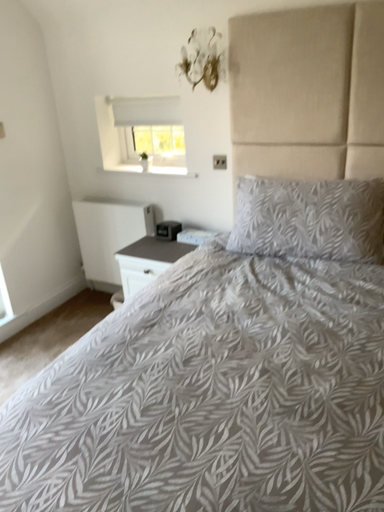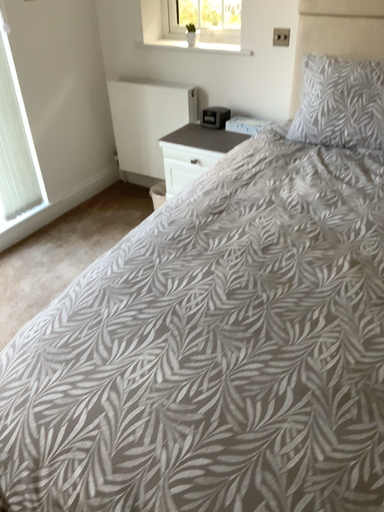
Question: Which way did the camera rotate in the video?

Choices:
 (A) rotated upward
 (B) rotated downward

Answer: (B)